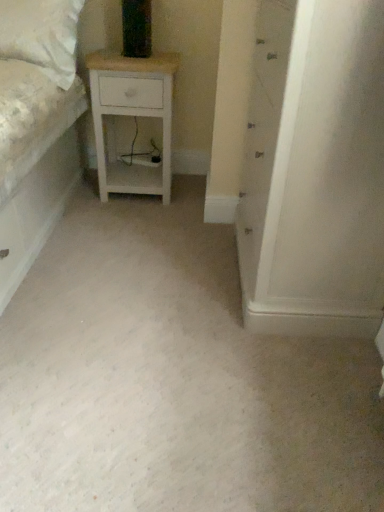
You are a GUI agent. You are given a task and a screenshot of the screen. Output one action in this format:
    pyautogui.click(x=<x>, y=<y>)
    Task: Click on the vacant space situated on the left part of white matte cabinet at center
    Image resolution: width=384 pixels, height=512 pixels.
    Given the screenshot: What is the action you would take?
    pyautogui.click(x=164, y=271)